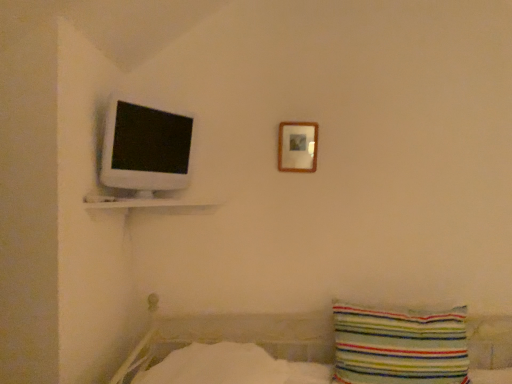
Question: From a real-world perspective, is white glossy shelf at upper left on top of striped fabric pillow at lower right?

Choices:
 (A) yes
 (B) no

Answer: (A)

Question: Does white glossy shelf at upper left have a lesser height compared to striped fabric pillow at lower right?

Choices:
 (A) no
 (B) yes

Answer: (B)

Question: Would you consider white glossy shelf at upper left to be distant from striped fabric pillow at lower right?

Choices:
 (A) yes
 (B) no

Answer: (B)

Question: Is white glossy shelf at upper left turned away from striped fabric pillow at lower right?

Choices:
 (A) yes
 (B) no

Answer: (B)

Question: Are white glossy shelf at upper left and striped fabric pillow at lower right beside each other?

Choices:
 (A) yes
 (B) no

Answer: (B)

Question: Relative to white soft bedsheet at lower center, is wooden picture frame at upper center in front or behind?

Choices:
 (A) front
 (B) behind

Answer: (B)

Question: From a real-world perspective, is wooden picture frame at upper center positioned above or below white soft bedsheet at lower center?

Choices:
 (A) above
 (B) below

Answer: (A)

Question: Based on their sizes in the image, would you say wooden picture frame at upper center is bigger or smaller than white soft bedsheet at lower center?

Choices:
 (A) small
 (B) big

Answer: (A)

Question: Is wooden picture frame at upper center spatially inside white soft bedsheet at lower center, or outside of it?

Choices:
 (A) inside
 (B) outside

Answer: (B)

Question: Relative to white glossy computer monitor at upper left, is white glossy shelf at upper left in front or behind?

Choices:
 (A) front
 (B) behind

Answer: (A)

Question: From a real-world perspective, is white glossy shelf at upper left physically located above or below white glossy computer monitor at upper left?

Choices:
 (A) below
 (B) above

Answer: (A)

Question: In terms of width, does white glossy shelf at upper left look wider or thinner when compared to white glossy computer monitor at upper left?

Choices:
 (A) wide
 (B) thin

Answer: (A)

Question: Is white glossy shelf at upper left taller or shorter than white glossy computer monitor at upper left?

Choices:
 (A) short
 (B) tall

Answer: (A)

Question: Based on their positions, is wooden picture frame at upper center located to the left or right of white glossy computer monitor at upper left?

Choices:
 (A) left
 (B) right

Answer: (B)

Question: Based on their sizes in the image, would you say wooden picture frame at upper center is bigger or smaller than white glossy computer monitor at upper left?

Choices:
 (A) small
 (B) big

Answer: (A)